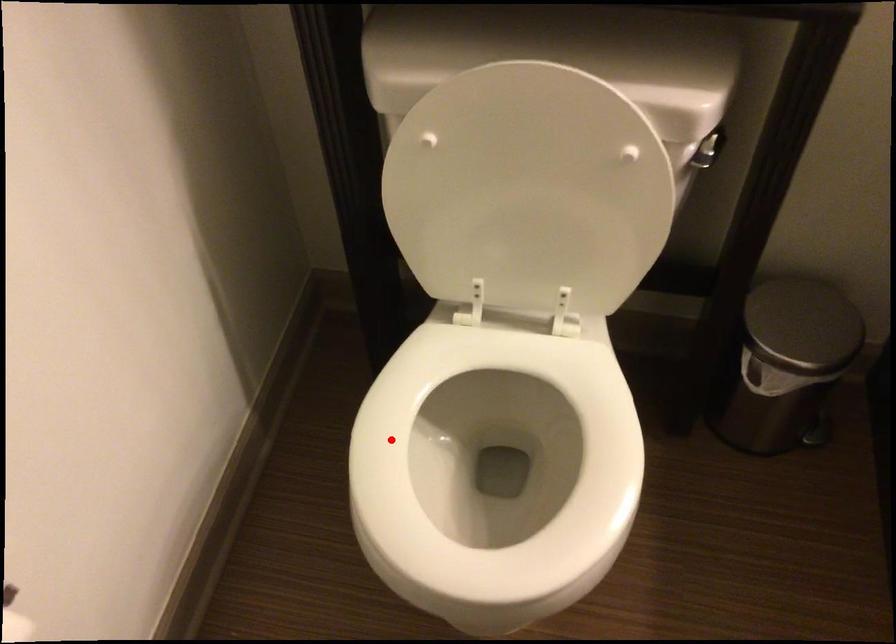
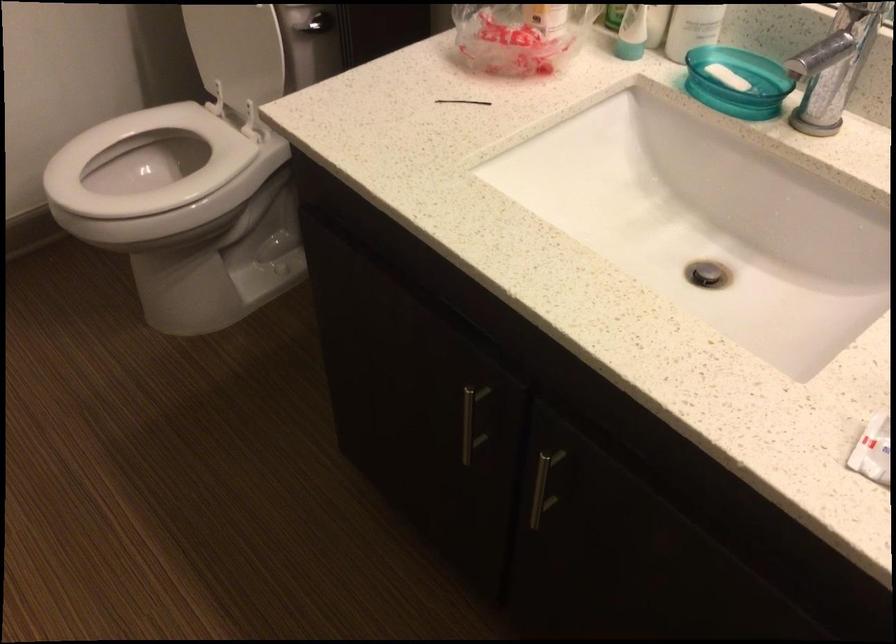
Question: I am providing you with two images of the same scene from different viewpoints. In image1, a red point is highlighted. Considering the same 3D point in image2, which of the following is correct?

Choices:
 (A) It is closer
 (B) It is farther

Answer: (B)